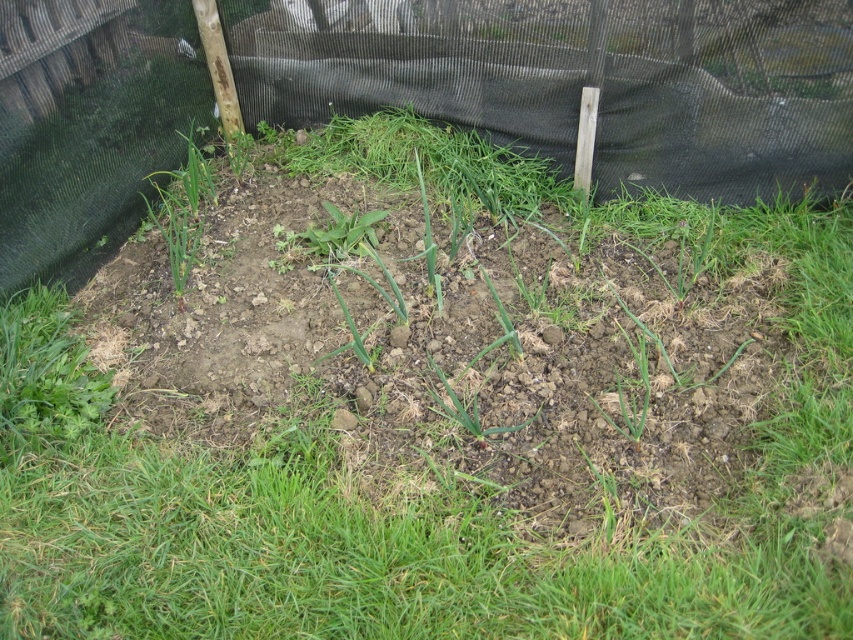
Question: Can you confirm if black mesh fence at upper center is positioned above green grass at upper left?

Choices:
 (A) yes
 (B) no

Answer: (A)

Question: Is black mesh fence at upper center further to camera compared to green grass at upper left?

Choices:
 (A) yes
 (B) no

Answer: (B)

Question: Which of the following is the closest to the observer?

Choices:
 (A) green grass at upper left
 (B) black mesh fence at upper center

Answer: (B)

Question: Which point is farther from the camera taking this photo?

Choices:
 (A) (161, 220)
 (B) (618, 113)

Answer: (A)

Question: Is black mesh fence at upper center to the left of green grass at upper left from the viewer's perspective?

Choices:
 (A) no
 (B) yes

Answer: (A)